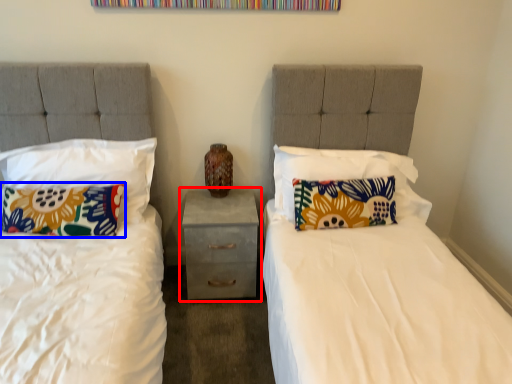
Question: Which object is closer to the camera taking this photo, nightstand (highlighted by a red box) or pillow (highlighted by a blue box)?

Choices:
 (A) nightstand
 (B) pillow

Answer: (B)